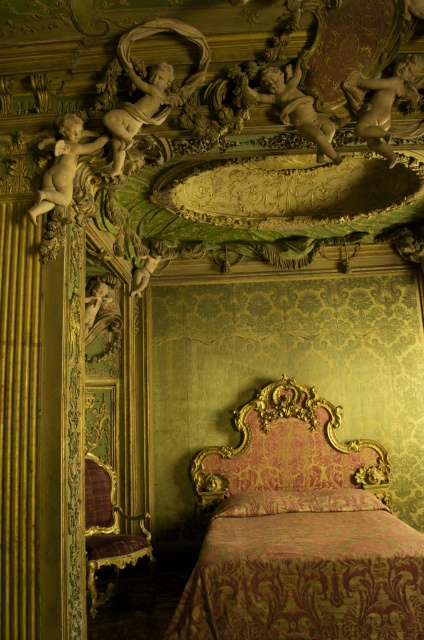
You are an interior designer assessing the placement of the matte gold cherub at upper right and the pink damask pillow at center in the room. Which object is positioned closer to the entrance of the room?

The matte gold cherub at upper right is closer to the viewer than the pink damask pillow at center, so the matte gold cherub at upper right is positioned closer to the entrance of the room.

You are an interior designer assessing the placement of a new chandelier in this ornate bedroom. The chandelier will be installed at the point marked by coordinates point (381, 100). Which existing decorative element is already positioned at this location?

The matte gold cherub at upper right is located at point (381, 100), so the existing decorative element at this location is the matte gold cherub at upper right.

You are an interior designer assessing the spatial arrangement of the room. You need to determine if the matte gold cherub at upper right can be placed on the same shelf as the pink damask pillow at center without overlapping. Which object has a smaller width?

The matte gold cherub at upper right has a lesser width compared to the pink damask pillow at center, so it can be placed on the same shelf without overlapping.